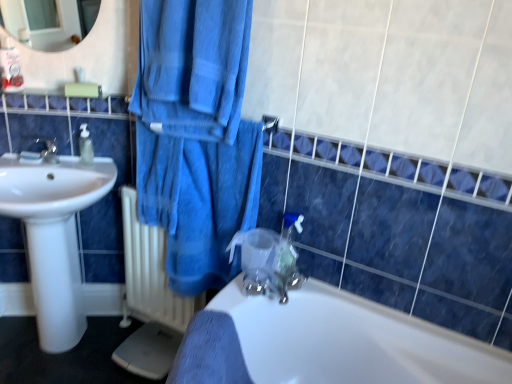
Question: Considering their positions, is white plastic balustrade at upper center located in front of or behind transparent plastic faucet at center?

Choices:
 (A) front
 (B) behind

Answer: (B)

Question: From the image's perspective, is white plastic balustrade at upper center located above or below transparent plastic faucet at center?

Choices:
 (A) above
 (B) below

Answer: (A)

Question: Considering the real-world distances, which object is closest to the transparent plastic faucet at center?

Choices:
 (A) white glossy sink at left
 (B) white glossy bathtub at lower center
 (C) clear plastic soap dispenser at left
 (D) white metallic radiator at lower left
 (E) white plastic balustrade at upper center

Answer: (B)

Question: Considering the real-world distances, which object is farthest from the white glossy bathtub at lower center?

Choices:
 (A) transparent plastic faucet at center
 (B) white metallic radiator at lower left
 (C) white glossy sink at left
 (D) white plastic balustrade at upper center
 (E) blue cotton towel at center

Answer: (D)